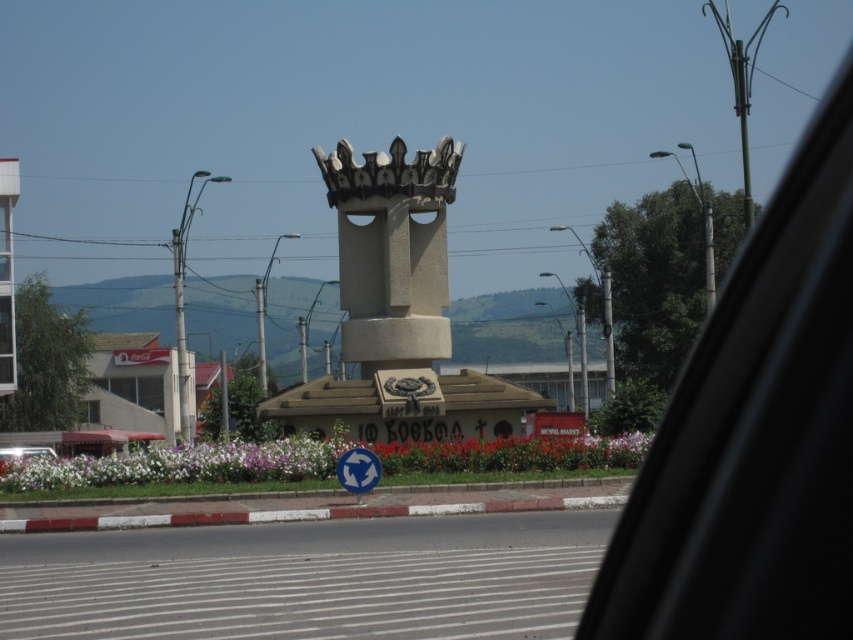
This screenshot has height=640, width=853. In order to click on white plastic traffic sign at center in this screenshot , I will do `click(358, 470)`.

Consider the image. Is white plastic traffic sign at center to the left of metallic silver car at lower left from the viewer's perspective?

No, white plastic traffic sign at center is not to the left of metallic silver car at lower left.

Which is behind, point (357, 451) or point (32, 452)?

The point (32, 452) is more distant.

Locate an element on the screen. The width and height of the screenshot is (853, 640). white plastic traffic sign at center is located at coordinates (358, 470).

Which is below, transparent glass car window at upper right or metallic silver car at lower left?

Positioned lower is metallic silver car at lower left.

Who is more distant from viewer, (x=834, y=317) or (x=44, y=451)?

The point (x=44, y=451) is more distant.

Which is in front, point (850, 128) or point (3, 451)?

Positioned in front is point (850, 128).

The height and width of the screenshot is (640, 853). What are the coordinates of `transparent glass car window at upper right` in the screenshot? It's located at (753, 433).

Who is more distant from viewer, (776, 232) or (375, 481)?

Positioned behind is point (375, 481).

The image size is (853, 640). What are the coordinates of `transparent glass car window at upper right` in the screenshot? It's located at (753, 433).